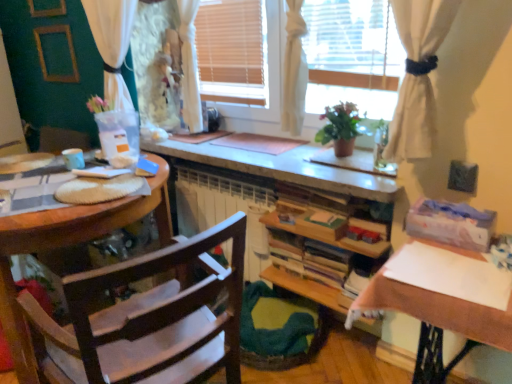
The width and height of the screenshot is (512, 384). I want to click on green matte plant at center, so click(340, 128).

What do you see at coordinates (328, 231) in the screenshot? I see `wooden bookshelf at center` at bounding box center [328, 231].

In order to click on wooden chair at left in this screenshot , I will do `click(149, 319)`.

Is the surface of white sheer curtain at upper left in direct contact with white paper at right?

No, white sheer curtain at upper left is not making contact with white paper at right.

Based on the photo, which object is further away from the camera taking this photo, white sheer curtain at upper left or white paper at right?

white sheer curtain at upper left is further from the camera.

Is white sheer curtain at upper left thinner than white paper at right?

Yes, white sheer curtain at upper left is thinner than white paper at right.

Between point (423, 364) and point (187, 334), which one is positioned in front?

The point (187, 334) is closer.

Consider the image. Is white paper at right taller than wooden chair at left?

Incorrect, the height of white paper at right is not larger of that of wooden chair at left.

Looking at this image, is white paper at right to the right of wooden chair at left from the viewer's perspective?

Yes.

Consider the image. Is the depth of white paper at right greater than that of wooden chair at left?

Yes, it is behind wooden chair at left.

Which of these two, white sheer curtain at upper left or white fabric window at center, is thinner?

Thinner between the two is white sheer curtain at upper left.

How much distance is there between white sheer curtain at upper left and white fabric window at center?

29.94 inches.

Is the depth of white sheer curtain at upper left greater than that of white fabric window at center?

Yes, white sheer curtain at upper left is further from the camera.

Between white sheer curtain at upper left and white fabric window at center, which one has less height?

With less height is white fabric window at center.

Find the location of `houseplant located above the wooden chair at left (from a real-world perspective)`. houseplant located above the wooden chair at left (from a real-world perspective) is located at coordinates (340, 128).

Is wooden chair at left in front of green matte plant at center?

Yes, wooden chair at left is closer to the camera.

Is wooden chair at left surrounding green matte plant at center?

No, green matte plant at center is not inside wooden chair at left.

Does wooden chair at left turn towards green matte plant at center?

No, wooden chair at left is not turned towards green matte plant at center.

Is green matte plant at center next to wooden bookshelf at center and touching it?

No, green matte plant at center is not making contact with wooden bookshelf at center.

Between green matte plant at center and wooden bookshelf at center, which one is positioned in front?

wooden bookshelf at center is more forward.

Which of these two, green matte plant at center or wooden bookshelf at center, is smaller?

Smaller between the two is green matte plant at center.

Considering the positions of point (349, 107) and point (311, 289), is point (349, 107) closer or farther from the camera than point (311, 289)?

Point (349, 107) is closer to the camera than point (311, 289).

Is white sheer curtain at upper left a part of wooden chair at left?

No, white sheer curtain at upper left is not surrounded by wooden chair at left.

From the image's perspective, relative to white sheer curtain at upper left, is wooden chair at left above or below?

From the image's perspective, wooden chair at left appears below white sheer curtain at upper left.

Which is in front, wooden chair at left or white sheer curtain at upper left?

Positioned in front is wooden chair at left.

The image size is (512, 384). Find the location of `curtain above the wooden chair at left (from the image's perspective)`. curtain above the wooden chair at left (from the image's perspective) is located at coordinates (111, 27).

Is white fabric window at center at the back of wooden chair at left?

No, wooden chair at left's orientation is not away from white fabric window at center.

Which object is further away from the camera, wooden chair at left or white fabric window at center?

white fabric window at center is more distant.

From the image's perspective, between wooden chair at left and white fabric window at center, who is located below?

wooden chair at left appears lower in the image.

At what (x,y) coordinates should I click in order to perform the action: click on chair below the white fabric window at center (from the image's perspective). Please return your answer as a coordinate pair (x, y). Looking at the image, I should click on (149, 319).

Where is `table directly beneath the white sheer curtain at upper left (from a real-world perspective)`? table directly beneath the white sheer curtain at upper left (from a real-world perspective) is located at coordinates (436, 319).

Identify the location of chair located above the white paper at right (from the image's perspective). The image size is (512, 384). (149, 319).

Considering their positions, is wooden bookshelf at center positioned further to wooden chair at left than white fabric window at center?

white fabric window at center is positioned further to the anchor wooden chair at left.

Which object lies nearer to the anchor point white sheer curtain at upper left, green matte plant at center or white paper at right?

Among the two, green matte plant at center is located nearer to white sheer curtain at upper left.

Based on their spatial positions, is white sheer curtain at upper left or wooden bookshelf at center further from green matte plant at center?

Based on the image, white sheer curtain at upper left appears to be further to green matte plant at center.

Which object lies further to the anchor point white paper at right, wooden chair at left or wooden bookshelf at center?

Based on the image, wooden chair at left appears to be further to white paper at right.

When comparing their distances from white fabric window at center, does wooden chair at left or white sheer curtain at upper left seem closer?

white sheer curtain at upper left is positioned closer to the anchor white fabric window at center.

Estimate the real-world distances between objects in this image. Which object is closer to wooden bookshelf at center, white fabric window at center or white paper at right?

The object closer to wooden bookshelf at center is white paper at right.

Considering their positions, is wooden bookshelf at center positioned closer to white sheer curtain at upper left than green matte plant at center?

green matte plant at center is closer to white sheer curtain at upper left.

Which object lies further to the anchor point wooden chair at left, green matte plant at center or wooden bookshelf at center?

Among the two, green matte plant at center is located further to wooden chair at left.

Locate an element on the screen. This screenshot has height=384, width=512. houseplant that lies between white fabric window at center and wooden bookshelf at center from top to bottom is located at coordinates (340, 128).

You are a GUI agent. You are given a task and a screenshot of the screen. Output one action in this format:
    pyautogui.click(x=<x>, y=<y>)
    Task: Click on the cabinetry situated between wooden chair at left and white paper at right from left to right
    This screenshot has width=512, height=384.
    Given the screenshot: What is the action you would take?
    pyautogui.click(x=328, y=231)

At what (x,y) coordinates should I click in order to perform the action: click on houseplant between white sheer curtain at upper left and wooden chair at left in the vertical direction. Please return your answer as a coordinate pair (x, y). Looking at the image, I should click on (340, 128).

Locate an element on the screen. This screenshot has height=384, width=512. houseplant that lies between white fabric window at center and wooden chair at left from top to bottom is located at coordinates (340, 128).